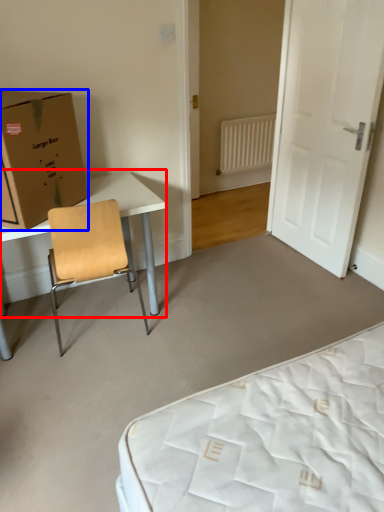
Question: Among these objects, which one is nearest to the camera, table (highlighted by a red box) or box (highlighted by a blue box)?

Choices:
 (A) table
 (B) box

Answer: (B)